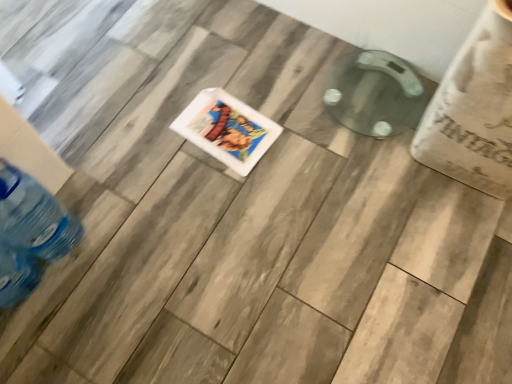
You are a GUI agent. You are given a task and a screenshot of the screen. Output one action in this format:
    pyautogui.click(x=<x>, y=<y>)
    Task: Click on the vacant area to the left of white glossy comic book at center
    The height and width of the screenshot is (384, 512).
    Given the screenshot: What is the action you would take?
    pyautogui.click(x=153, y=130)